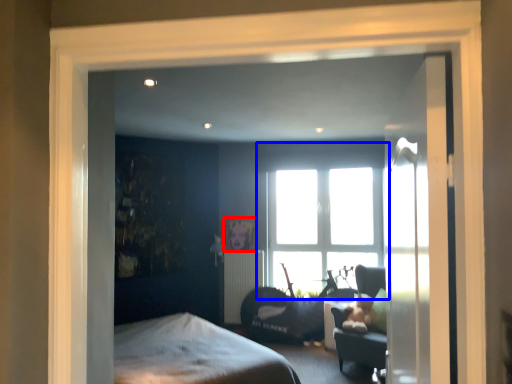
Question: Which point is closer to the camera, picture frame (highlighted by a red box) or window (highlighted by a blue box)?

Choices:
 (A) picture frame
 (B) window

Answer: (B)